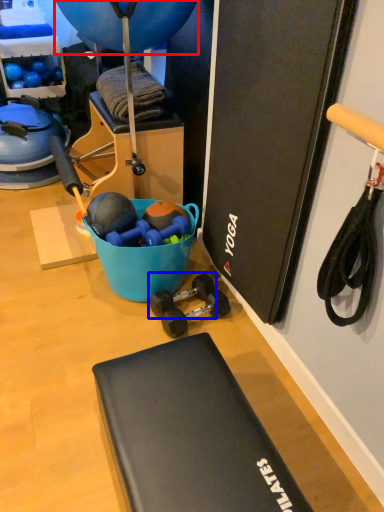
Question: Which object appears closest to the camera in this image, balloon (highlighted by a red box) or dumbbell (highlighted by a blue box)?

Choices:
 (A) balloon
 (B) dumbbell

Answer: (A)